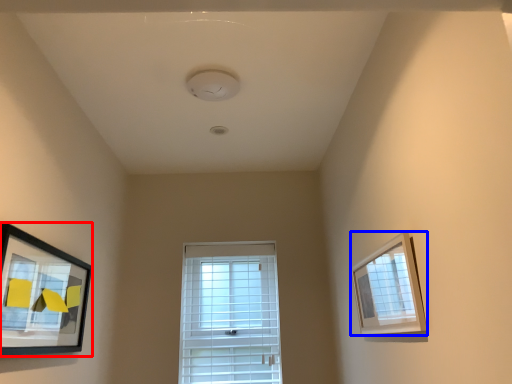
Question: Among these objects, which one is nearest to the camera, picture frame (highlighted by a red box) or picture frame (highlighted by a blue box)?

Choices:
 (A) picture frame
 (B) picture frame

Answer: (A)